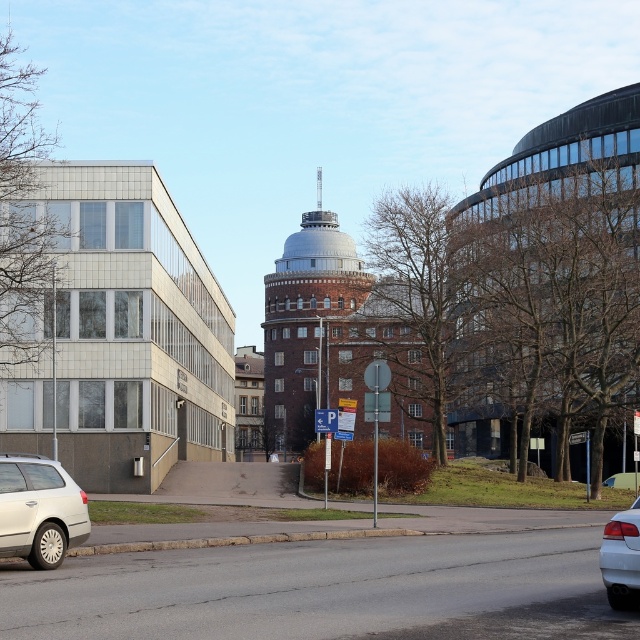
Question: Can you confirm if silver metallic station wagon at lower left is positioned below white glossy sedan at lower right?

Choices:
 (A) no
 (B) yes

Answer: (A)

Question: Which of the following is the closest to the observer?

Choices:
 (A) silver metallic station wagon at lower left
 (B) white glossy sedan at lower right
 (C) red brick tower at center

Answer: (B)

Question: Does red brick tower at center have a larger size compared to white glossy sedan at lower right?

Choices:
 (A) yes
 (B) no

Answer: (A)

Question: Which point is farther to the camera?

Choices:
 (A) red brick tower at center
 (B) silver metallic station wagon at lower left

Answer: (A)

Question: Which is farther from the silver metallic station wagon at lower left?

Choices:
 (A) red brick tower at center
 (B) white glossy sedan at lower right

Answer: (A)

Question: Considering the relative positions of silver metallic station wagon at lower left and white glossy sedan at lower right in the image provided, where is silver metallic station wagon at lower left located with respect to white glossy sedan at lower right?

Choices:
 (A) right
 (B) left

Answer: (B)